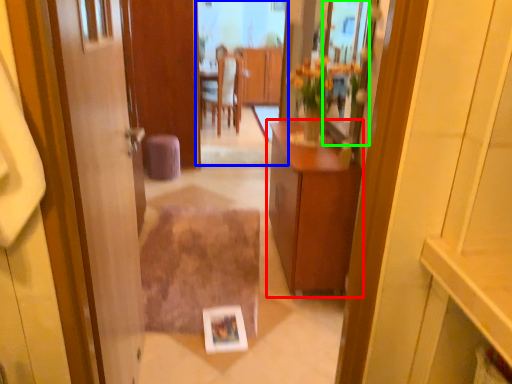
Question: Considering the real-world distances, which object is closest to cabinetry (highlighted by a red box)? mirror (highlighted by a blue box) or mirror (highlighted by a green box).

Choices:
 (A) mirror
 (B) mirror

Answer: (B)